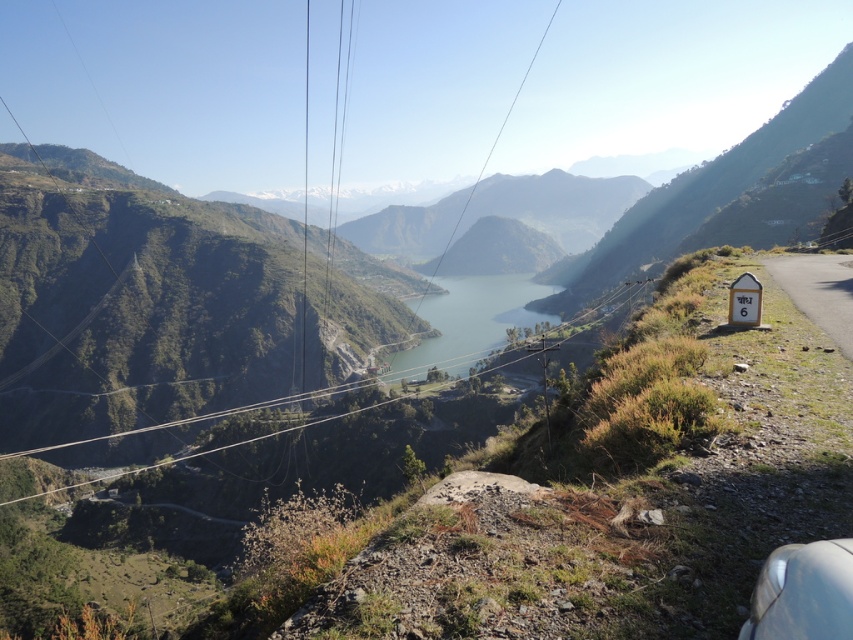
Question: Is transparent wire at center wider than blue glassy lake at center?

Choices:
 (A) yes
 (B) no

Answer: (A)

Question: Can you confirm if white glossy cable car at lower right is wider than white plastic sign at right?

Choices:
 (A) yes
 (B) no

Answer: (B)

Question: Considering the real-world distances, which object is closest to the white plastic sign at right?

Choices:
 (A) transparent wire at center
 (B) blue glassy lake at center
 (C) white glossy cable car at lower right

Answer: (C)

Question: Can you confirm if white glossy cable car at lower right is bigger than white plastic sign at right?

Choices:
 (A) no
 (B) yes

Answer: (A)

Question: Which of the following is the closest to the observer?

Choices:
 (A) white plastic sign at right
 (B) blue glassy lake at center
 (C) transparent wire at center
 (D) white glossy cable car at lower right

Answer: (D)

Question: Which point is farther to the camera?

Choices:
 (A) white plastic sign at right
 (B) white glossy cable car at lower right

Answer: (A)